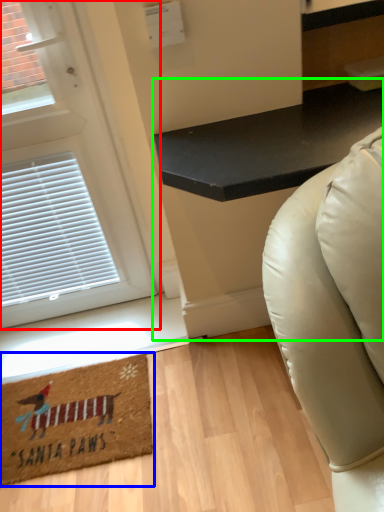
Question: Which is farther away from door (highlighted by a red box)? mat (highlighted by a blue box) or table (highlighted by a green box)?

Choices:
 (A) mat
 (B) table

Answer: (B)